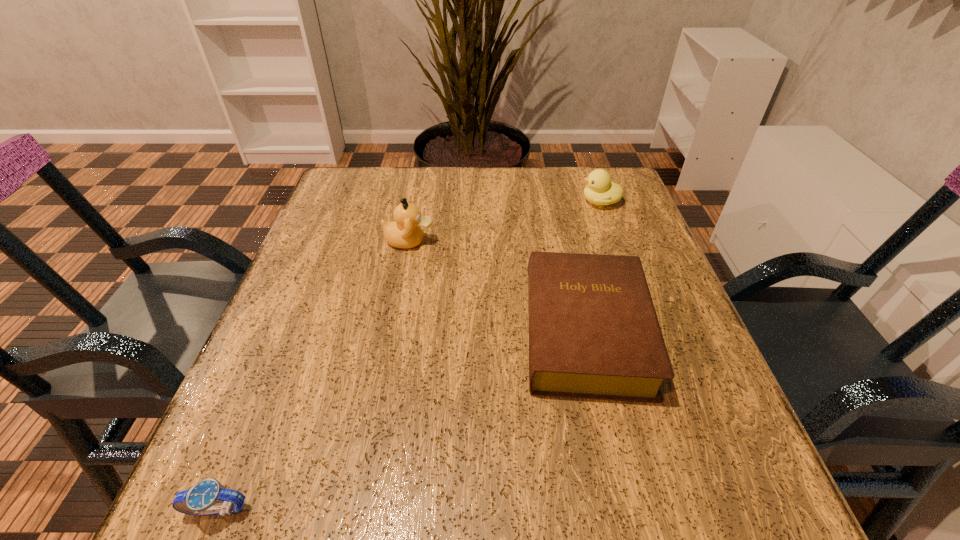
Where is `object that is at the far right corner`? object that is at the far right corner is located at coordinates (600, 191).

The width and height of the screenshot is (960, 540). Identify the location of blank space at the far edge. (482, 205).

This screenshot has width=960, height=540. Identify the location of free point at the near edge. (446, 470).

At what (x,y) coordinates should I click in order to perform the action: click on vacant area at the left edge. Please return your answer as a coordinate pair (x, y). This screenshot has height=540, width=960. Looking at the image, I should click on (340, 239).

In the image, there is a desktop. What are the coordinates of `vacant space at the right edge` in the screenshot? It's located at (717, 450).

The image size is (960, 540). In the image, there is a desktop. Find the location of `vacant area at the near left corner`. vacant area at the near left corner is located at coordinates (224, 484).

Identify the location of vacant area at the far right corner of the desktop. (588, 211).

In the image, there is a desktop. Identify the location of vacant area at the near right corner. (684, 462).

The width and height of the screenshot is (960, 540). Find the location of `free space between the farthest object and the nearest object`. free space between the farthest object and the nearest object is located at coordinates (409, 356).

In order to click on free space between the second shortest object and the taller duckling in this screenshot , I will do `click(497, 286)`.